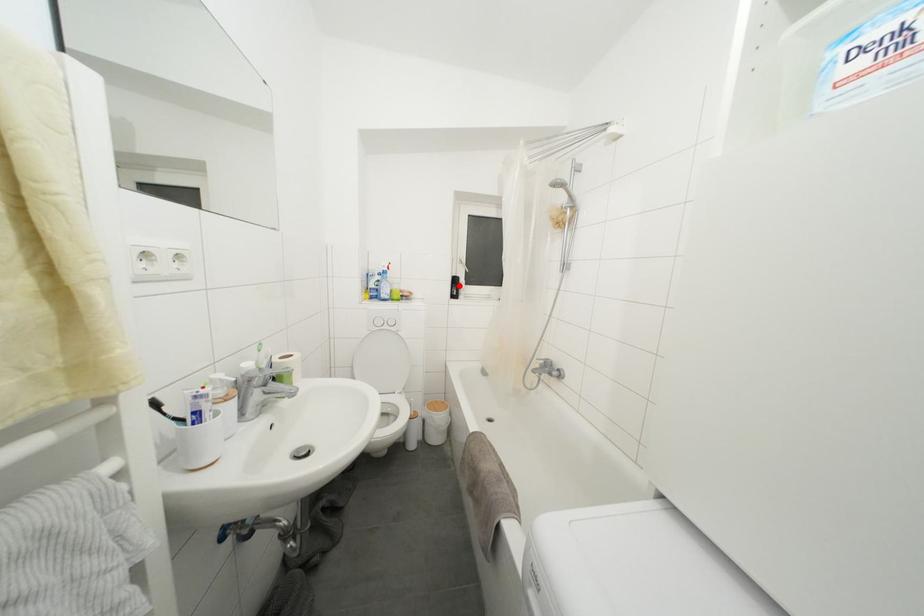
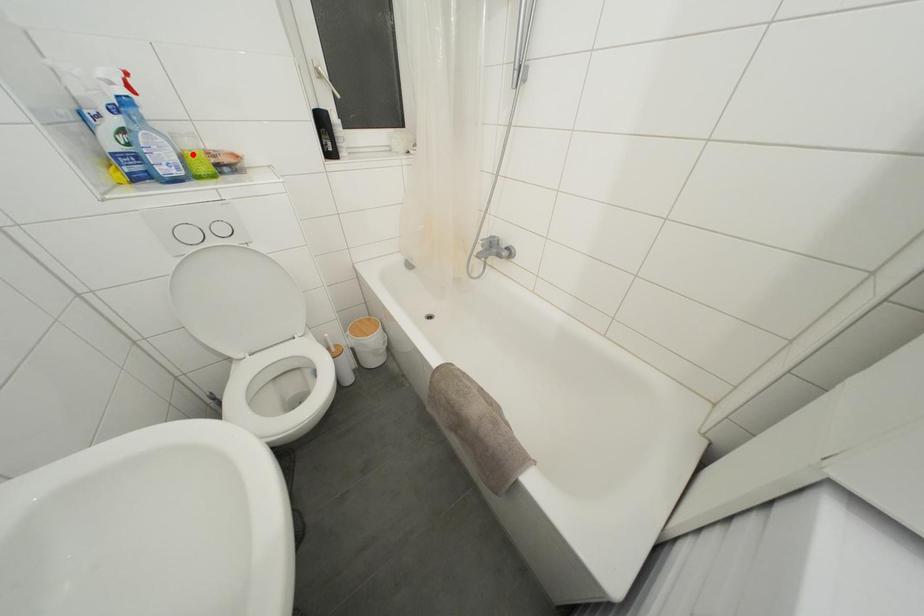
I am providing you with two images of the same scene from different viewpoints. A red point is marked on the first image and another point is marked on the second image. Is the red point in image1 aligned with the point shown in image2?

No